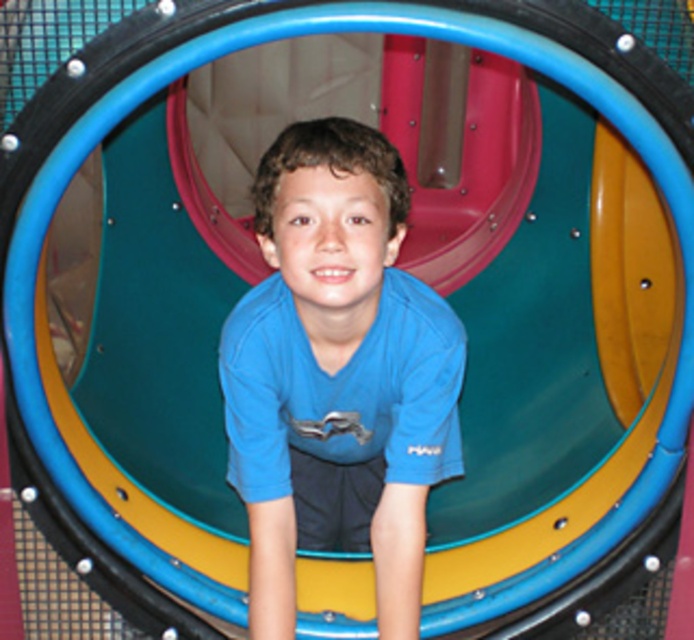
Is point (303, 136) less distant than point (378, 449)?

Yes, point (303, 136) is closer to viewer.

Does blue matte shirt at center have a greater width compared to matte blue shirt at center?

Yes, blue matte shirt at center is wider than matte blue shirt at center.

Locate an element on the screen. Image resolution: width=694 pixels, height=640 pixels. blue matte shirt at center is located at coordinates point(337,376).